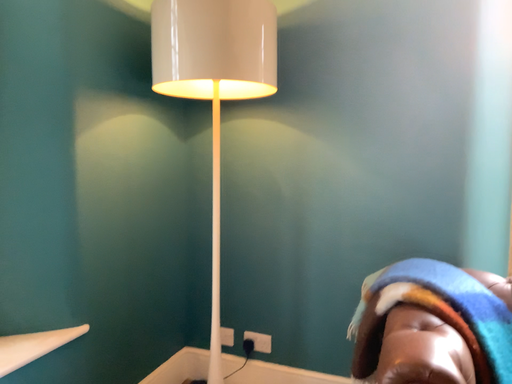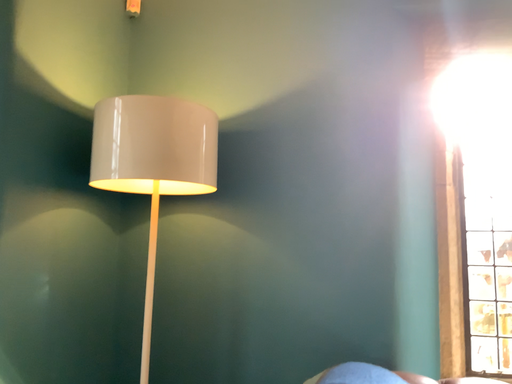
Question: Which way did the camera rotate in the video?

Choices:
 (A) rotated downward
 (B) rotated upward

Answer: (B)